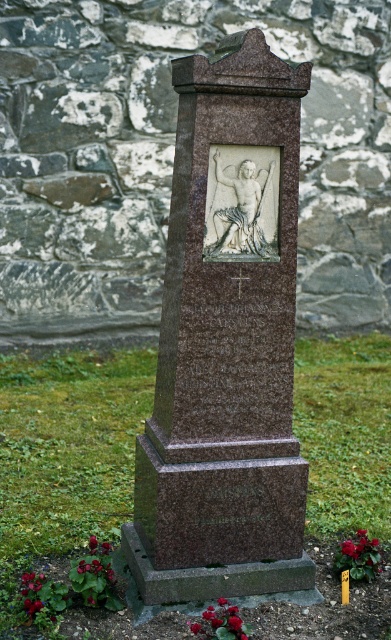
You are standing in a cemetery and see a brown polished stone monument at center. There is a point marked at coordinates (225, 346). Where is this point located?

The point marked at coordinates (225, 346) is on the brown polished stone monument at center.